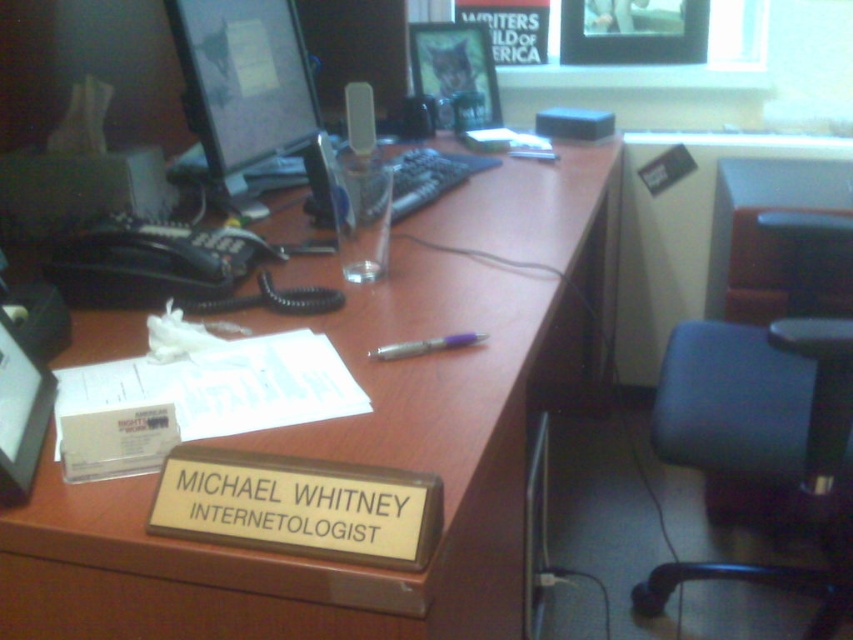
Can you confirm if brown wood desk at center is wider than silver metallic pen at center?

Yes.

Can you confirm if brown wood desk at center is bigger than silver metallic pen at center?

Indeed, brown wood desk at center has a larger size compared to silver metallic pen at center.

Is point (407, 422) positioned before point (459, 346)?

Yes, point (407, 422) is closer to viewer.

You are a GUI agent. You are given a task and a screenshot of the screen. Output one action in this format:
    pyautogui.click(x=<x>, y=<y>)
    Task: Click on the brown wood desk at center
    
    Given the screenshot: What is the action you would take?
    pyautogui.click(x=364, y=440)

Which of these two, black leather swivel chair at right or silver metallic pen at center, stands shorter?

silver metallic pen at center

Does point (701, 404) come in front of point (436, 340)?

No.

Between point (807, 499) and point (439, 349), which one is positioned behind?

Point (807, 499)

Find the location of a particular element. black leather swivel chair at right is located at coordinates (763, 442).

Does matte black monitor at upper left appear on the right side of silver metallic pen at center?

In fact, matte black monitor at upper left is to the left of silver metallic pen at center.

Which is behind, point (281, 45) or point (383, 348)?

Point (281, 45)

You are a GUI agent. You are given a task and a screenshot of the screen. Output one action in this format:
    pyautogui.click(x=<x>, y=<y>)
    Task: Click on the matte black monitor at upper left
    
    Given the screenshot: What is the action you would take?
    pyautogui.click(x=244, y=83)